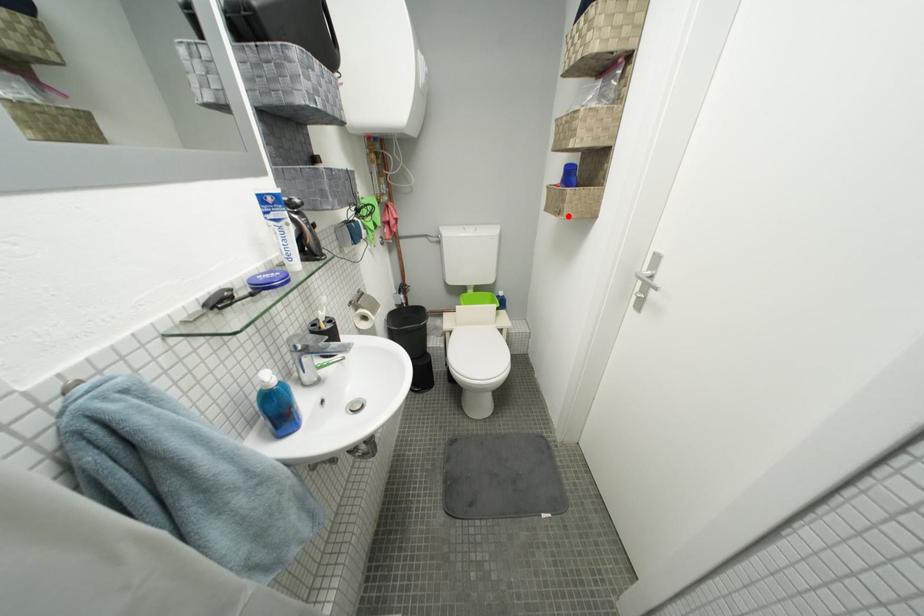
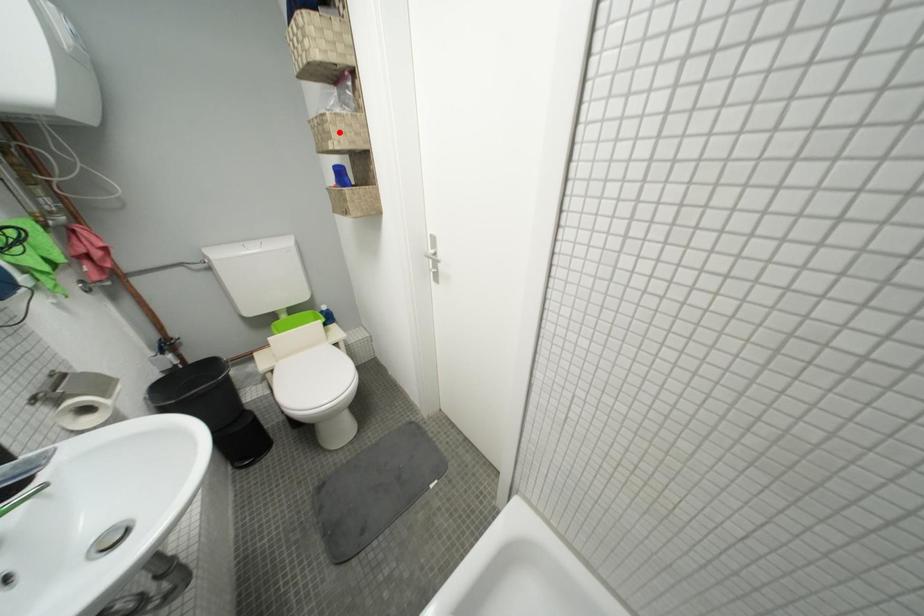
I am providing you with two images of the same scene from different viewpoints. A red point is marked on the first image and another point is marked on the second image. Do the highlighted points in image1 and image2 indicate the same real-world spot?

No